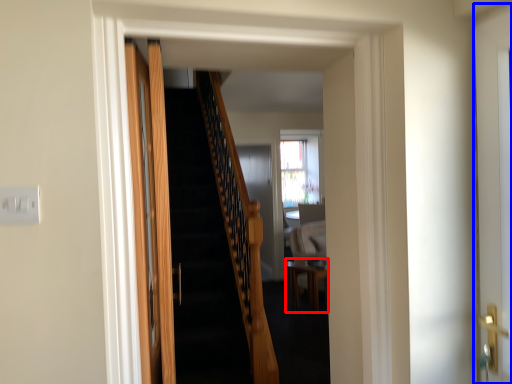
Question: Which point is closer to the camera, table (highlighted by a red box) or door (highlighted by a blue box)?

Choices:
 (A) table
 (B) door

Answer: (B)